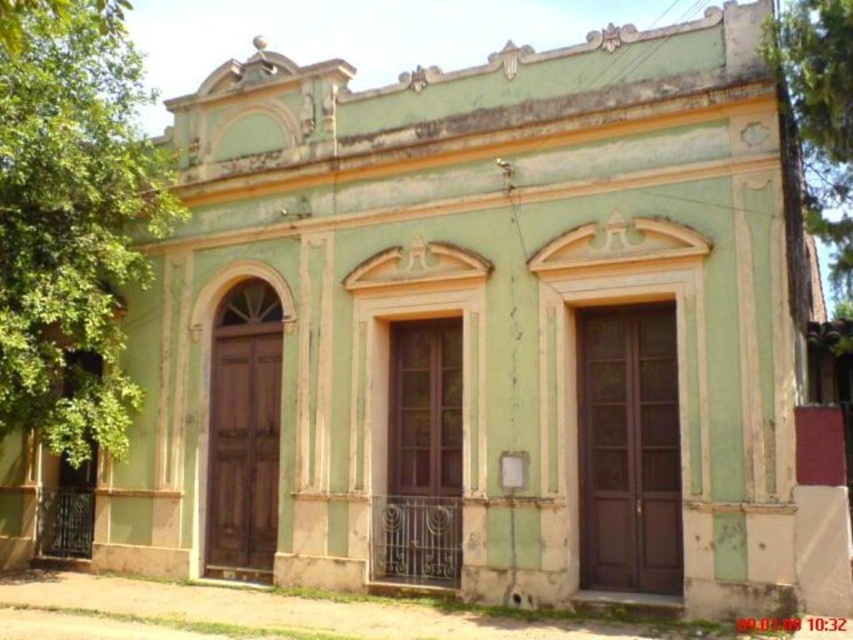
Question: Which object is farther from the camera taking this photo?

Choices:
 (A) green leafy tree at left
 (B) green textured tree at upper right

Answer: (B)

Question: Is green leafy tree at left to the right of green textured tree at upper right from the viewer's perspective?

Choices:
 (A) no
 (B) yes

Answer: (A)

Question: Is green leafy tree at left to the right of green textured tree at upper right from the viewer's perspective?

Choices:
 (A) yes
 (B) no

Answer: (B)

Question: Which of the following is the closest to the observer?

Choices:
 (A) green leafy tree at left
 (B) green textured tree at upper right

Answer: (A)

Question: Is green leafy tree at left closer to the viewer compared to green textured tree at upper right?

Choices:
 (A) yes
 (B) no

Answer: (A)

Question: Which object is farther from the camera taking this photo?

Choices:
 (A) green leafy tree at left
 (B) green textured tree at upper right

Answer: (B)